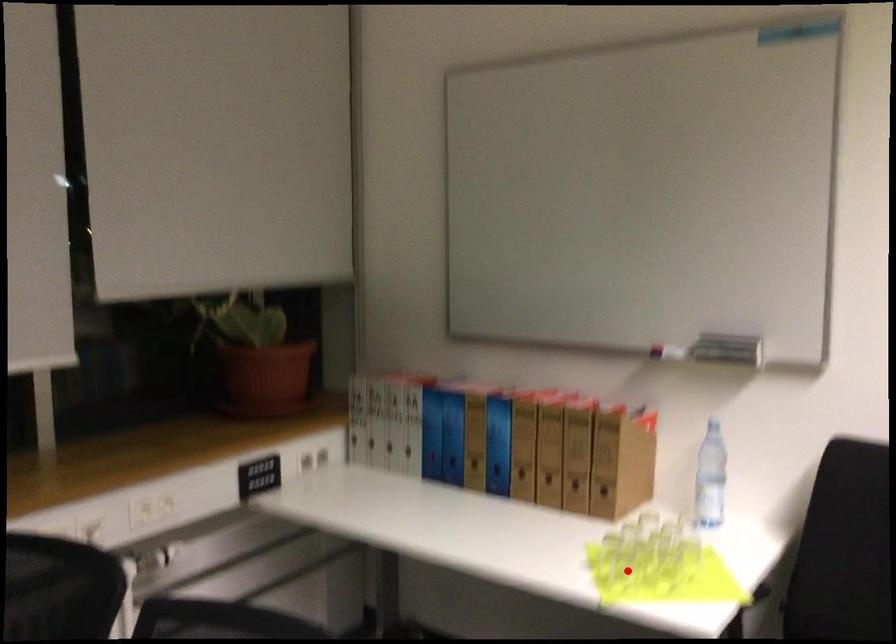
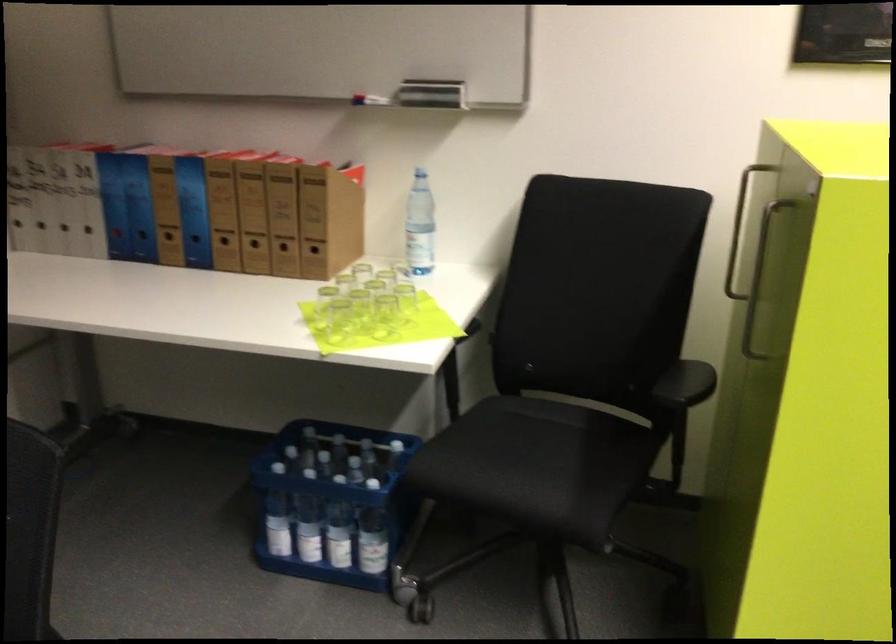
Where in the second image is the point corresponding to the highlighted location from the first image?

(339, 319)